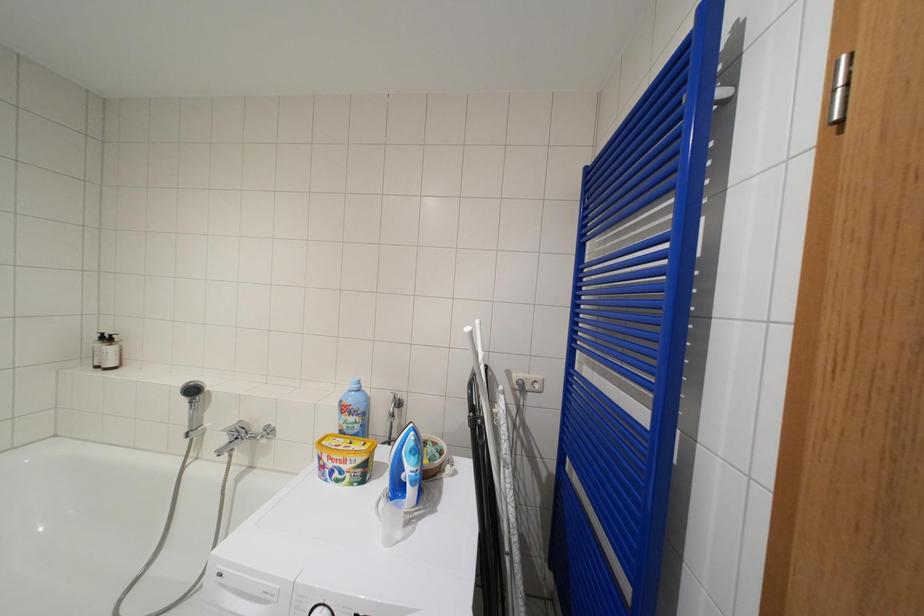
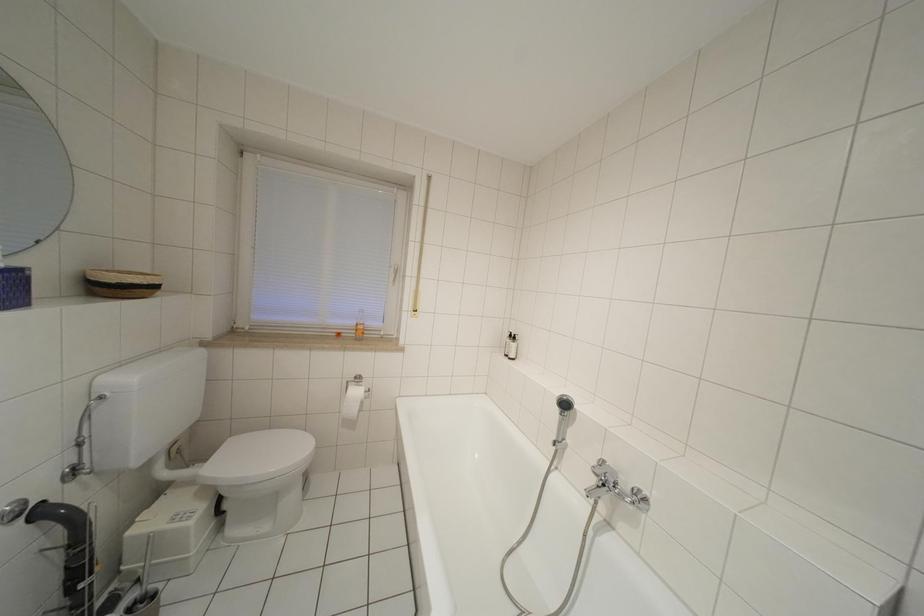
Question: How did the camera likely rotate?

Choices:
 (A) Left
 (B) Right
 (C) Up
 (D) Down

Answer: (A)